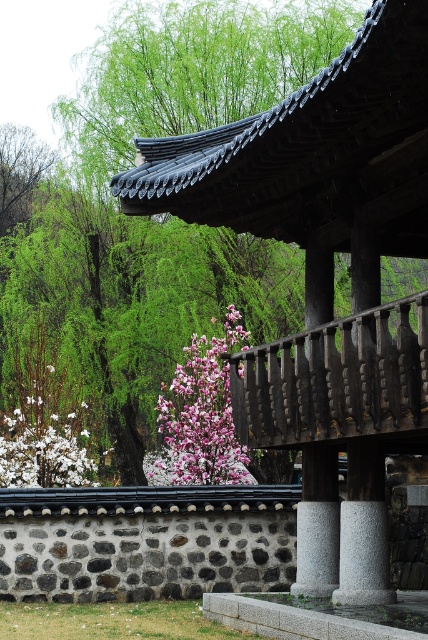
You are standing in the temple garden and see a pink glossy flower at center. Can you confirm if the point at coordinates (x=201, y=416) is located on this flower?

Yes, the point at coordinates (x=201, y=416) is on the pink glossy flower at center.

You are standing at the entrance of the temple garden and want to pick both the pink glossy flower at center and the white matte flower at lower left. If you can only carry one flower at a time, which flower should you pick first to minimize the total distance walked?

You should pick the white matte flower at lower left first because it is closer to the entrance, and then walk to the pink glossy flower at center, resulting in a shorter total distance compared to picking the pink glossy flower at center first.